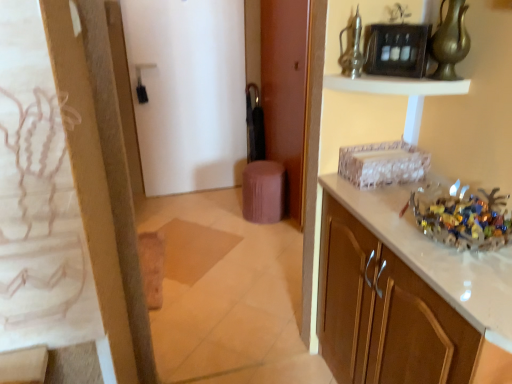
Question: In terms of width, does white glossy cabinet at right look wider or thinner when compared to white matte door at center, the 1th door viewed from the left?

Choices:
 (A) wide
 (B) thin

Answer: (A)

Question: In the image, is white glossy cabinet at right positioned in front of or behind white matte door at center, the 1th door viewed from the left?

Choices:
 (A) behind
 (B) front

Answer: (B)

Question: Which object is the closest to the white matte door at center, the 1th door viewed from the left?

Choices:
 (A) white glossy cabinet at right
 (B) translucent glass bowl at right
 (C) brown matte door at center, the second door positioned from the left
 (D) gold metallic vase at upper right, acting as the 2th glass vase starting from the left
 (E) metallic glass vase at upper center, which appears as the first glass vase when viewed from the left

Answer: (C)

Question: Based on their relative distances, which object is farther from the brown matte door at center, acting as the 1th door starting from the right?

Choices:
 (A) metallic glass vase at upper center, the 2th glass vase from the right
 (B) white glossy shelf at upper center
 (C) purple fabric stool at center
 (D) gold metallic vase at upper right, the 1th glass vase viewed from the right
 (E) white matte door at center, the 1th door viewed from the left

Answer: (D)